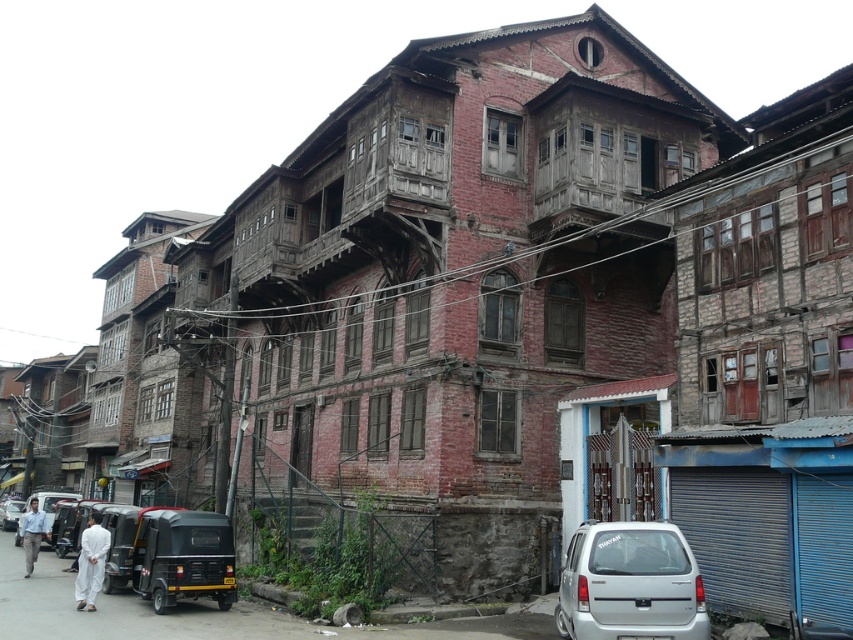
You are a pedestrian standing on the street looking at the two vehicles, the silver metallic van at lower right and the black matte car at lower left. Which vehicle is nearer to you?

The silver metallic van at lower right is closer to the viewer than the black matte car at lower left.

Looking at this image, you are a delivery person trying to place a large package on the ground. You see the white cotton pants at lower left and the black matte car at lower left. Which object can you place the package next to without blocking the car?

The white cotton pants at lower left is thinner than the black matte car at lower left, so placing the package next to the white cotton pants at lower left would be less likely to block the car.

You are a pedestrian standing at the center of the street. You see a silver metallic van at lower right and a black matte car at lower left. Which vehicle is closer to your right side?

The silver metallic van at lower right is positioned on the right side of black matte car at lower left, so it is closer to your right side.